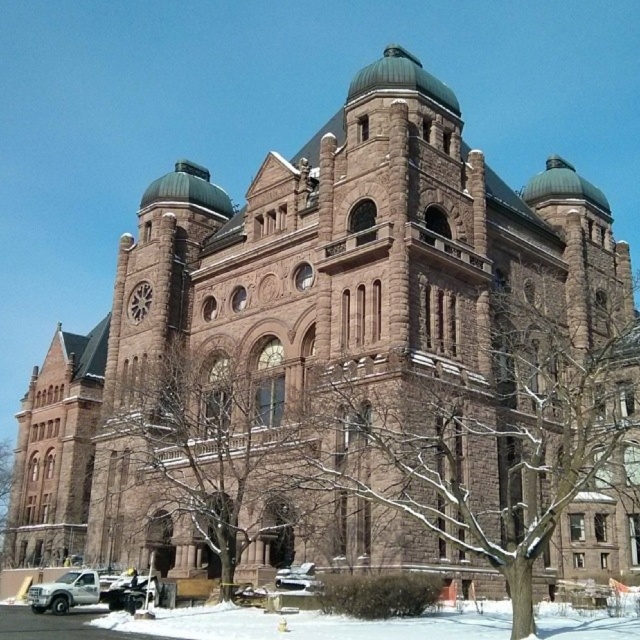
You are a pedestrian standing at the bottom of the grand historic building. You see a silver metallic truck at lower left and a silver metallic car at lower center. Which vehicle is closer to the base of the building?

The silver metallic truck at lower left is closer to the base of the building because it is located below the silver metallic car at lower center, which places it lower in the scene.

You are a delivery driver trying to park your silver metallic truck at lower left near the white powdery snow at lower center. Can you park the truck so that it is directly to the left of the snow?

Yes, since the white powdery snow at lower center is already to the right of the silver metallic truck at lower left, parking the truck there would place it directly to the left of the snow.